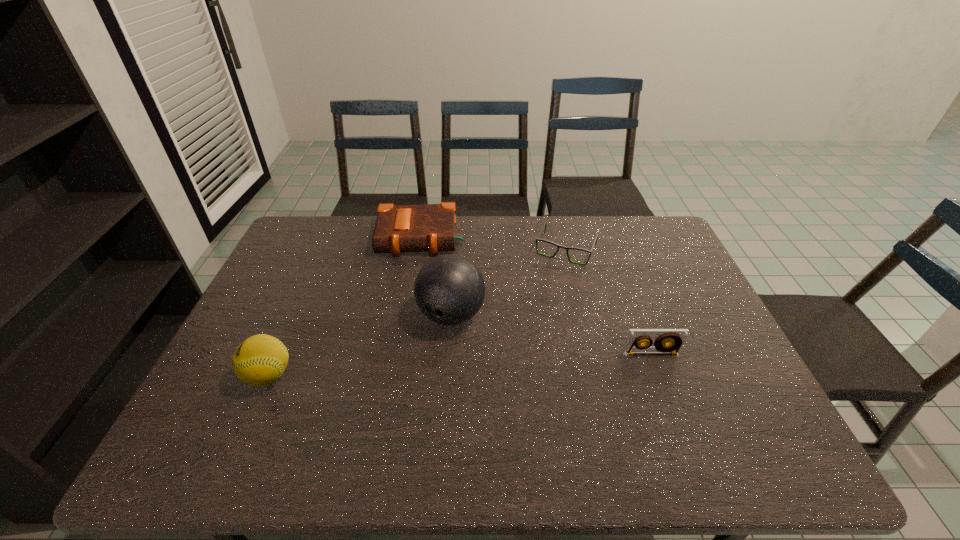
Locate an element on the screen. free space on the desktop that is between the leftmost object and the videotape and is positioned on the spine side of the second shortest object is located at coordinates (409, 368).

Locate an element on the screen. The height and width of the screenshot is (540, 960). vacant space on the desktop that is between the fourth shortest object and the videotape and is positioned on the lens of the shortest object is located at coordinates (516, 362).

At what (x,y) coordinates should I click in order to perform the action: click on vacant space on the desktop that is between the softball and the videotape and is positioned on the grip area of the tallest object. Please return your answer as a coordinate pair (x, y). The image size is (960, 540). Looking at the image, I should click on (416, 368).